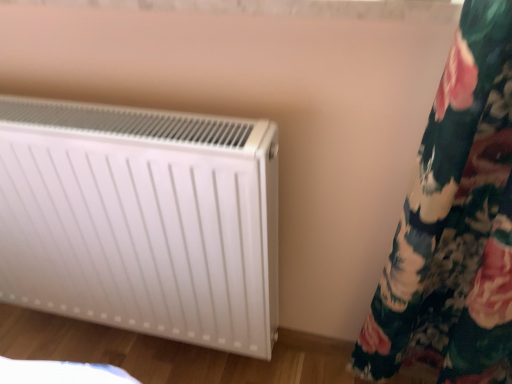
This screenshot has width=512, height=384. I want to click on white matte radiator at left, so click(x=142, y=220).

Describe the element at coordinates (142, 220) in the screenshot. I see `white matte radiator at left` at that location.

Locate an element on the screen. white matte radiator at left is located at coordinates click(142, 220).